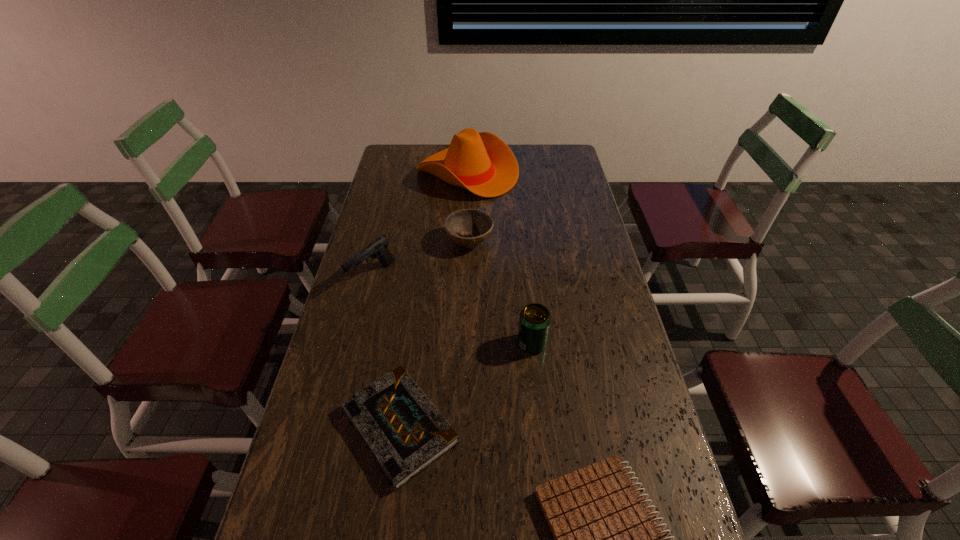
You are a GUI agent. You are given a task and a screenshot of the screen. Output one action in this format:
    pyautogui.click(x=<x>, y=<y>)
    Task: Click on the cowboy hat
    This screenshot has height=540, width=960.
    Given the screenshot: What is the action you would take?
    pyautogui.click(x=482, y=163)

You are a GUI agent. You are given a task and a screenshot of the screen. Output one action in this format:
    pyautogui.click(x=<x>, y=<y>)
    Task: Click on the farthest object
    This screenshot has height=540, width=960.
    Given the screenshot: What is the action you would take?
    pyautogui.click(x=482, y=163)

At what (x,y) coordinates should I click in order to perform the action: click on the third nearest object. Please return your answer as a coordinate pair (x, y). This screenshot has height=540, width=960. Looking at the image, I should click on pyautogui.click(x=535, y=319).

This screenshot has width=960, height=540. Identify the location of the fourth nearest object. (378, 248).

This screenshot has width=960, height=540. I want to click on bowl, so click(466, 222).

Find the location of a particular element. The height and width of the screenshot is (540, 960). the third shortest object is located at coordinates (466, 222).

This screenshot has width=960, height=540. Find the location of `the left notebook`. the left notebook is located at coordinates (405, 433).

The width and height of the screenshot is (960, 540). Find the location of `the fifth tallest object`. the fifth tallest object is located at coordinates (405, 433).

In order to click on vacant space located on the front of the tallest object in this screenshot , I will do `click(466, 226)`.

Locate an element on the screen. This screenshot has height=540, width=960. free space located 0.170m on the back of the third nearest object is located at coordinates (526, 291).